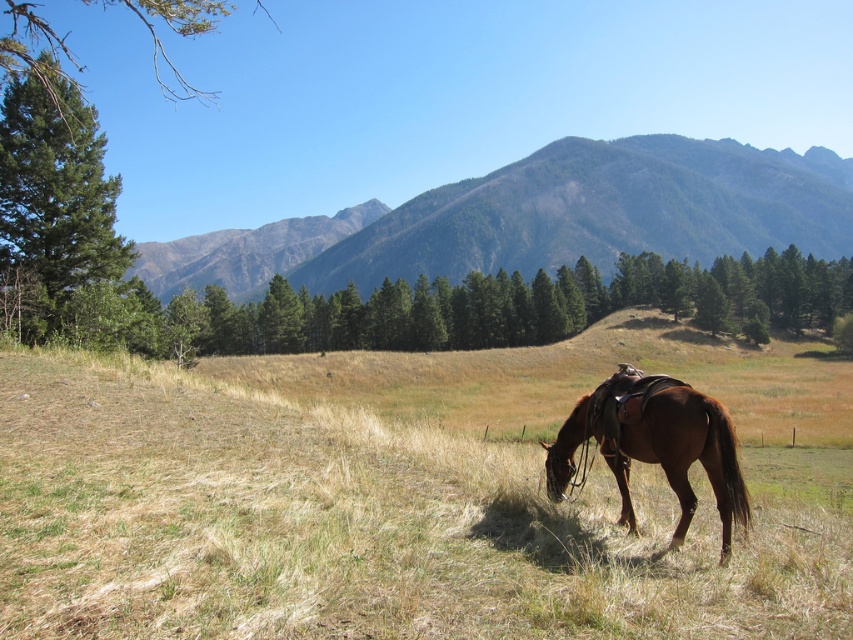
Question: Is green textured pine tree at upper left positioned at the back of brown glossy horse at lower center?

Choices:
 (A) yes
 (B) no

Answer: (A)

Question: Which object is the farthest from the green textured pine tree at upper left?

Choices:
 (A) brown glossy horse at lower center
 (B) green forested mountain at upper center

Answer: (B)

Question: Is green textured pine tree at upper left above brown glossy horse at lower center?

Choices:
 (A) no
 (B) yes

Answer: (B)

Question: Based on their relative distances, which object is farther from the green forested mountain at upper center?

Choices:
 (A) brown glossy horse at lower center
 (B) green textured pine tree at upper left

Answer: (A)

Question: Which point appears farthest from the camera in this image?

Choices:
 (A) (1, 141)
 (B) (651, 442)

Answer: (A)

Question: Does green textured pine tree at upper left appear over brown glossy horse at lower center?

Choices:
 (A) yes
 (B) no

Answer: (A)